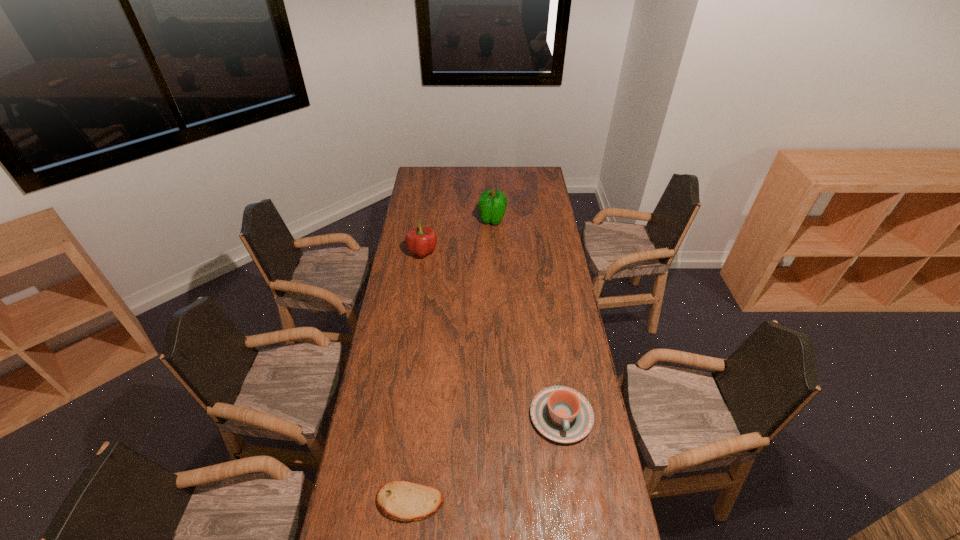
What are the coordinates of `free space between the shorter bell pepper and the chinaware` in the screenshot? It's located at (492, 334).

Identify the location of vacant space that is in between the second farthest object and the chinaware. The width and height of the screenshot is (960, 540). (492, 334).

Where is `unoccupied position between the third shortest object and the nearest object`? The height and width of the screenshot is (540, 960). unoccupied position between the third shortest object and the nearest object is located at coordinates (417, 377).

At what (x,y) coordinates should I click in order to perform the action: click on blank region between the pita bread and the right bell pepper. Please return your answer as a coordinate pair (x, y). Looking at the image, I should click on (451, 361).

Where is `vacant point located between the third tallest object and the shortest object`? The width and height of the screenshot is (960, 540). vacant point located between the third tallest object and the shortest object is located at coordinates (486, 459).

Where is `vacant area between the nearest object and the chinaware`? This screenshot has height=540, width=960. vacant area between the nearest object and the chinaware is located at coordinates (486, 459).

Where is `free spot between the rightmost object and the nearest object`? free spot between the rightmost object and the nearest object is located at coordinates (486, 459).

Where is `vacant area between the right bell pepper and the chinaware`? vacant area between the right bell pepper and the chinaware is located at coordinates (527, 318).

At what (x,y) coordinates should I click in order to perform the action: click on vacant point located between the shorter bell pepper and the second nearest object. Please return your answer as a coordinate pair (x, y). This screenshot has width=960, height=540. Looking at the image, I should click on (492, 334).

Point out which object is positioned as the second nearest to the rightmost object. Please provide its 2D coordinates. Your answer should be formatted as a tuple, i.e. [(x, y)], where the tuple contains the x and y coordinates of a point satisfying the conditions above.

[(420, 241)]